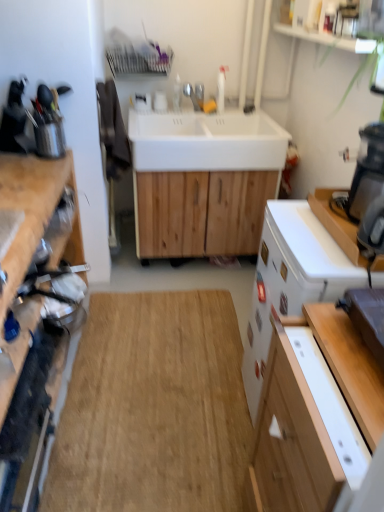
The image size is (384, 512). What do you see at coordinates (153, 408) in the screenshot?
I see `natural wood table at center` at bounding box center [153, 408].

This screenshot has height=512, width=384. Identify the location of white glossy sink at center, which appears as the 1th sink when viewed from the top. (206, 141).

Measure the distance between wooden cutting board at left, the 2th cabinetry in the right-to-left sequence, and camera.

wooden cutting board at left, the 2th cabinetry in the right-to-left sequence, and camera are 3.56 feet apart.

Where is `white glossy cabinet at lower right, which is the 1th cabinetry from right to left`? white glossy cabinet at lower right, which is the 1th cabinetry from right to left is located at coordinates (310, 415).

Looking at this image, from the image's perspective, is white glossy cabinet at lower right, the second cabinetry positioned from the left, located above or below metallic silver knife block at left?

Clearly, from the image's perspective, white glossy cabinet at lower right, the second cabinetry positioned from the left, is below metallic silver knife block at left.

Which point is more forward, (x=279, y=368) or (x=17, y=88)?

Point (x=279, y=368)

Is white glossy cabinet at lower right, the second cabinetry positioned from the left, placed right next to metallic silver knife block at left?

They are not placed beside each other.

Is white glossy dishwasher at right at the right side of white glossy cabinet at lower right, which is the 1th cabinetry from right to left?

Correct, you'll find white glossy dishwasher at right to the right of white glossy cabinet at lower right, which is the 1th cabinetry from right to left.

Considering the relative sizes of white glossy dishwasher at right and white glossy cabinet at lower right, the second cabinetry positioned from the left, in the image provided, is white glossy dishwasher at right thinner than white glossy cabinet at lower right, the second cabinetry positioned from the left,?

Incorrect, the width of white glossy dishwasher at right is not less than that of white glossy cabinet at lower right, the second cabinetry positioned from the left.

From the picture: From the image's perspective, which one is positioned lower, white glossy dishwasher at right or white glossy cabinet at lower right, which is the 1th cabinetry from right to left?

white glossy cabinet at lower right, which is the 1th cabinetry from right to left, from the image's perspective.

Does white glossy dishwasher at right have a larger size compared to white glossy cabinet at lower right, which is the 1th cabinetry from right to left?

Correct, white glossy dishwasher at right is larger in size than white glossy cabinet at lower right, which is the 1th cabinetry from right to left.

Measure the distance from white glossy sink at center, arranged as the 2th sink when ordered from the bottom, to white glossy cabinet at lower right, the second cabinetry positioned from the left.

white glossy sink at center, arranged as the 2th sink when ordered from the bottom, and white glossy cabinet at lower right, the second cabinetry positioned from the left, are 1.47 meters apart from each other.

From their relative heights in the image, would you say white glossy sink at center, which appears as the 1th sink when viewed from the top, is taller or shorter than white glossy cabinet at lower right, the second cabinetry positioned from the left?

white glossy sink at center, which appears as the 1th sink when viewed from the top, is shorter than white glossy cabinet at lower right, the second cabinetry positioned from the left.

Which object is further away from the camera taking this photo, white glossy sink at center, arranged as the 2th sink when ordered from the bottom, or white glossy cabinet at lower right, the second cabinetry positioned from the left?

white glossy sink at center, arranged as the 2th sink when ordered from the bottom, is further away from the camera.

Can you tell me how much white glossy sink at center, which appears as the 1th sink when viewed from the top, and white glossy cabinet at lower right, the second cabinetry positioned from the left, differ in facing direction?

There is a 90.8-degree angle between the facing directions of white glossy sink at center, which appears as the 1th sink when viewed from the top, and white glossy cabinet at lower right, the second cabinetry positioned from the left.

From a real-world perspective, is metallic silver knife block at left over wooden cutting board at left, the 2th cabinetry in the right-to-left sequence?

Yes, from a real-world perspective, metallic silver knife block at left is on top of wooden cutting board at left, the 2th cabinetry in the right-to-left sequence.

From the image's perspective, is metallic silver knife block at left above or below wooden cutting board at left, the 2th cabinetry in the right-to-left sequence?

metallic silver knife block at left is situated higher than wooden cutting board at left, the 2th cabinetry in the right-to-left sequence, in the image.

Is metallic silver knife block at left positioned far away from wooden cutting board at left, placed as the 1th cabinetry when sorted from left to right?

Actually, metallic silver knife block at left and wooden cutting board at left, placed as the 1th cabinetry when sorted from left to right, are a little close together.

How different are the orientations of metallic silver knife block at left and wooden cutting board at left, the 2th cabinetry in the right-to-left sequence, in degrees?

There is a 12.5-degree angle between the facing directions of metallic silver knife block at left and wooden cutting board at left, the 2th cabinetry in the right-to-left sequence.

Is white glossy sink at center, arranged as the 2th sink when ordered from the bottom, located outside natural wood table at center?

Indeed, white glossy sink at center, arranged as the 2th sink when ordered from the bottom, is completely outside natural wood table at center.

Is white glossy sink at center, arranged as the 2th sink when ordered from the bottom, at the left side of natural wood table at center?

In fact, white glossy sink at center, arranged as the 2th sink when ordered from the bottom, is to the right of natural wood table at center.

Considering the positions of objects white glossy sink at center, arranged as the 2th sink when ordered from the bottom, and natural wood table at center in the image provided, who is in front, white glossy sink at center, arranged as the 2th sink when ordered from the bottom, or natural wood table at center?

natural wood table at center is more forward.

At what (x,y) coordinates should I click in order to perform the action: click on hardwood directly beneath the white glossy sink at center, arranged as the 2th sink when ordered from the bottom (from a real-world perspective). Please return your answer as a coordinate pair (x, y). Looking at the image, I should click on (153, 408).

Is white glossy sink at center, arranged as the 2th sink when ordered from the bottom, facing towards white glossy table at lower right?

Yes, white glossy sink at center, arranged as the 2th sink when ordered from the bottom, faces towards white glossy table at lower right.

Is white glossy table at lower right inside white glossy sink at center, which appears as the 1th sink when viewed from the top?

No, white glossy sink at center, which appears as the 1th sink when viewed from the top, does not contain white glossy table at lower right.

In the scene shown: From the image's perspective, which is above, white glossy sink at center, which appears as the 1th sink when viewed from the top, or white glossy table at lower right?

From the image's view, white glossy sink at center, which appears as the 1th sink when viewed from the top, is above.

Measure the distance between metallic silver knife block at left and white matte sink at center, arranged as the 1th sink when ordered from the bottom.

34.61 inches.

From a real-world perspective, is metallic silver knife block at left positioned above or below white matte sink at center, arranged as the 1th sink when ordered from the bottom?

Clearly, from a real-world perspective, metallic silver knife block at left is above white matte sink at center, arranged as the 1th sink when ordered from the bottom.

The height and width of the screenshot is (512, 384). Identify the location of appliance on the left of the white matte sink at center, arranged as the 1th sink when ordered from the bottom. (13, 118).

Is metallic silver knife block at left bigger than white matte sink at center, arranged as the 1th sink when ordered from the bottom?

Incorrect, metallic silver knife block at left is not larger than white matte sink at center, arranged as the 1th sink when ordered from the bottom.

The image size is (384, 512). In the image, there is a white glossy cabinet at lower right, the second cabinetry positioned from the left. Find the location of `appliance above it (from the image's perspective)`. appliance above it (from the image's perspective) is located at coordinates (13, 118).

From a real-world perspective, which cabinetry is the 2nd one underneath the white glossy dishwasher at right? Please provide its 2D coordinates.

[(310, 415)]

Based on their spatial positions, is white glossy dishwasher at right or white glossy sink at center, which appears as the 1th sink when viewed from the top, further from natural wood table at center?

Based on the image, white glossy sink at center, which appears as the 1th sink when viewed from the top, appears to be further to natural wood table at center.

When comparing their distances from metallic silver knife block at left, does white glossy cabinet at lower right, the second cabinetry positioned from the left, or white matte sink at center, arranged as the 1th sink when ordered from the bottom, seem further?

white glossy cabinet at lower right, the second cabinetry positioned from the left, is further to metallic silver knife block at left.

Which object lies nearer to the anchor point white glossy dishwasher at right, metallic silver knife block at left or natural wood table at center?

Among the two, natural wood table at center is located nearer to white glossy dishwasher at right.

Which object lies nearer to the anchor point wooden cutting board at left, placed as the 1th cabinetry when sorted from left to right, natural wood table at center or white matte sink at center, arranged as the 1th sink when ordered from the bottom?

natural wood table at center lies closer to wooden cutting board at left, placed as the 1th cabinetry when sorted from left to right, than the other object.

Considering their positions, is white glossy cabinet at lower right, the second cabinetry positioned from the left, positioned closer to white glossy sink at center, which appears as the 1th sink when viewed from the top, than white matte sink at center, which is the second sink in top-to-bottom order?

The object closer to white glossy sink at center, which appears as the 1th sink when viewed from the top, is white matte sink at center, which is the second sink in top-to-bottom order.

Looking at the image, which one is located further to white glossy dishwasher at right, metallic silver knife block at left or white matte sink at center, arranged as the 1th sink when ordered from the bottom?

The object further to white glossy dishwasher at right is metallic silver knife block at left.

Which object lies further to the anchor point white matte sink at center, arranged as the 1th sink when ordered from the bottom, metallic silver knife block at left or wooden cutting board at left, the 2th cabinetry in the right-to-left sequence?

metallic silver knife block at left lies further to white matte sink at center, arranged as the 1th sink when ordered from the bottom, than the other object.

Which object lies nearer to the anchor point white glossy cabinet at lower right, the second cabinetry positioned from the left, white glossy dishwasher at right or white glossy table at lower right?

white glossy table at lower right lies closer to white glossy cabinet at lower right, the second cabinetry positioned from the left, than the other object.

What are the coordinates of `sink between metallic silver knife block at left and white glossy sink at center, arranged as the 2th sink when ordered from the bottom` in the screenshot? It's located at (203, 180).

Find the location of a particular element. The height and width of the screenshot is (512, 384). table between white glossy cabinet at lower right, the second cabinetry positioned from the left, and white matte sink at center, arranged as the 1th sink when ordered from the bottom, along the z-axis is located at coordinates (350, 367).

Identify the location of sink located between white glossy table at lower right and white matte sink at center, which is the second sink in top-to-bottom order, in the depth direction. coord(206,141).

Image resolution: width=384 pixels, height=512 pixels. In order to click on dish washer between white glossy cabinet at lower right, which is the 1th cabinetry from right to left, and white glossy sink at center, which appears as the 1th sink when viewed from the top, in the front-back direction in this screenshot , I will do `click(291, 280)`.